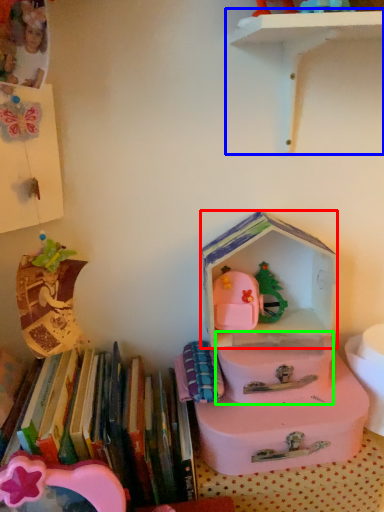
Question: Based on their relative distances, which object is farther from storage box (highlighted by a red box)? Choose from shelf (highlighted by a blue box) and box (highlighted by a green box).

Choices:
 (A) shelf
 (B) box

Answer: (A)